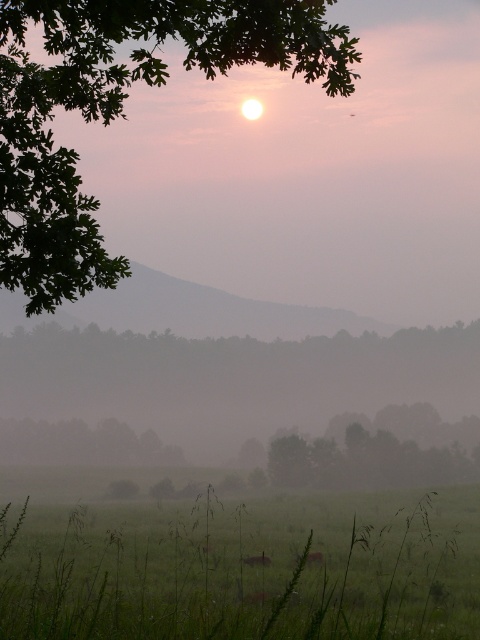
Who is shorter, green leafy tree at upper left or fluffy pink flower at lower center?

With less height is fluffy pink flower at lower center.

Looking at this image, is green leafy tree at upper left bigger than fluffy pink flower at lower center?

Indeed, green leafy tree at upper left has a larger size compared to fluffy pink flower at lower center.

Locate an element on the screen. Image resolution: width=480 pixels, height=640 pixels. green leafy tree at upper left is located at coordinates (120, 109).

Locate an element on the screen. green leafy tree at upper left is located at coordinates (120, 109).

Is point (117, 604) less distant than point (37, 291)?

That is True.

Who is more distant from viewer, (219, 612) or (130, 26)?

The point (219, 612) is more distant.

Identify the location of green grassy pasture at lower center. The height and width of the screenshot is (640, 480). (244, 570).

Is point (106, 515) behind point (264, 554)?

Yes, point (106, 515) is behind point (264, 554).

Locate an element on the screen. Image resolution: width=480 pixels, height=640 pixels. green grassy pasture at lower center is located at coordinates (244, 570).

Identify the location of green grassy pasture at lower center. The image size is (480, 640). (x=244, y=570).